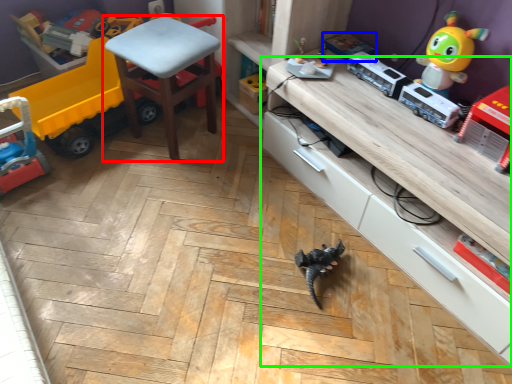
Question: Which object is positioned farthest from chair (highlighted by a red box)? Select from toy (highlighted by a blue box) and cabinetry (highlighted by a green box).

Choices:
 (A) toy
 (B) cabinetry

Answer: (B)